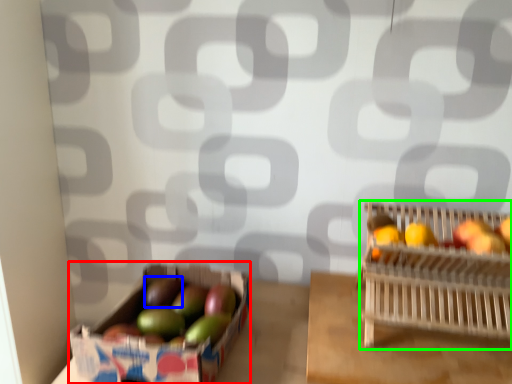
Question: Which is farther away from cardboard box (highlighted by a red box)? apple (highlighted by a blue box) or basket (highlighted by a green box)?

Choices:
 (A) apple
 (B) basket

Answer: (B)